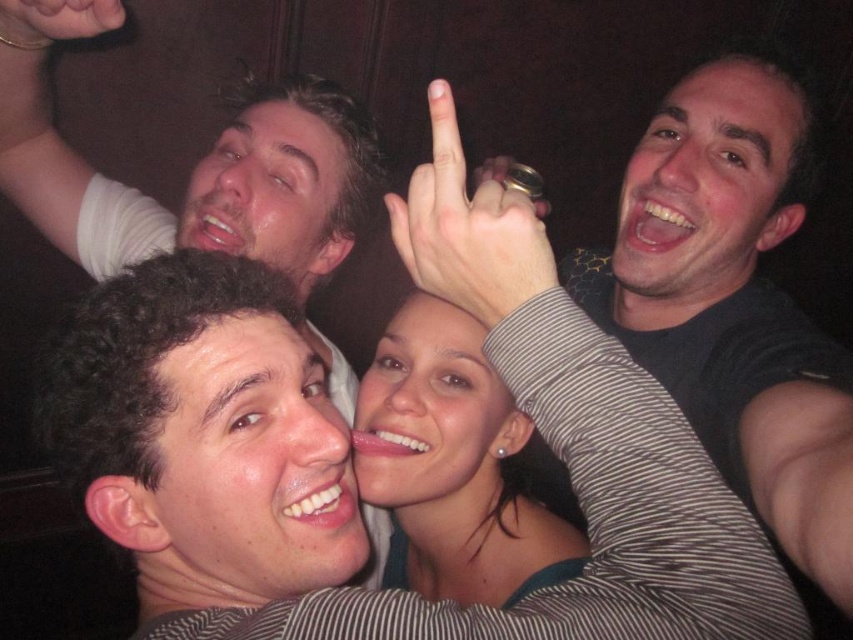
Question: In this image, where is black matte shirt at upper right located relative to matte black hand at upper left?

Choices:
 (A) right
 (B) left

Answer: (A)

Question: Is black matte shirt at upper right to the left of matte black hand at upper left from the viewer's perspective?

Choices:
 (A) no
 (B) yes

Answer: (A)

Question: Which point is farther from the camera taking this photo?

Choices:
 (A) (555, 269)
 (B) (453, 372)
 (C) (103, 4)
 (D) (791, 540)

Answer: (B)

Question: Among these objects, which one is farthest from the camera?

Choices:
 (A) gold ring at upper center
 (B) black matte shirt at upper right
 (C) matte black hand at upper left
 (D) matte green dress at center

Answer: (D)

Question: Which of the following is the closest to the observer?

Choices:
 (A) black matte shirt at upper right
 (B) matte green dress at center
 (C) matte black hand at upper left

Answer: (A)

Question: Considering the relative positions of matte green dress at center and gold ring at upper center in the image provided, where is matte green dress at center located with respect to gold ring at upper center?

Choices:
 (A) below
 (B) above

Answer: (A)